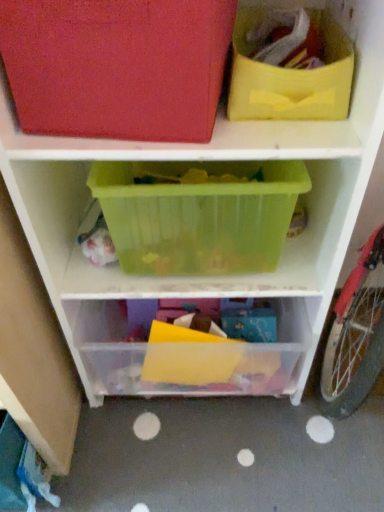
Question: From a real-world perspective, is yellow fabric bag at upper right positioned above or below matte red storage bin at upper left, the 1th shelf when ordered from top to bottom?

Choices:
 (A) above
 (B) below

Answer: (B)

Question: Choose the correct answer: Is yellow fabric bag at upper right inside matte red storage bin at upper left, the 1th shelf when ordered from top to bottom, or outside it?

Choices:
 (A) inside
 (B) outside

Answer: (B)

Question: Estimate the real-world distances between objects in this image. Which object is farther from the matte red storage bin at upper left, positioned as the third shelf in bottom-to-top order?

Choices:
 (A) transparent plastic container at center, arranged as the third shelf when viewed from the top
 (B) translucent plastic container at center, which appears as the 2th shelf when viewed from the top
 (C) yellow fabric bag at upper right

Answer: (A)

Question: Estimate the real-world distances between objects in this image. Which object is closer to the translucent plastic container at center, which appears as the 2th shelf when viewed from the top?

Choices:
 (A) yellow fabric bag at upper right
 (B) matte red storage bin at upper left, positioned as the third shelf in bottom-to-top order
 (C) transparent plastic container at center, arranged as the third shelf when viewed from the top

Answer: (B)